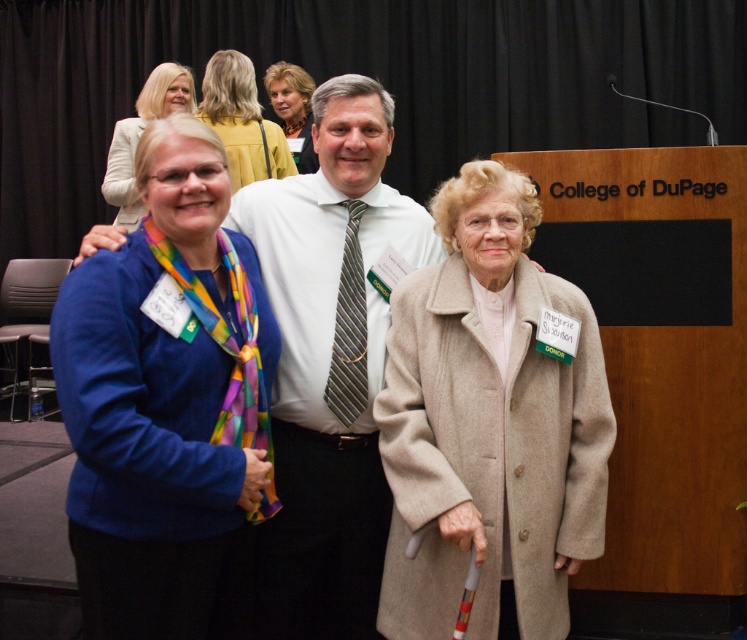
You are a photographer at the College of DuPage event. You need to ensure that the white shirt at center and the striped fabric tie at center are both visible in the photo. Given that your camera has a minimum focus distance of 15 centimeters, will both items be in focus?

The distance between the white shirt at center and the striped fabric tie at center is 16.55 centimeters. Since the minimum focus distance of the camera is 15 centimeters, both items will be within the focus range and thus visible clearly in the photo.

You are a photographer at the College of DuPage event and need to adjust the lighting to ensure both the blue soft scarf at left and the matte blue sweater at upper left are well lit. Since the scarf is on the right side of the sweater, where should you position the light source to avoid shadows on both items?

To avoid shadows on both the blue soft scarf at left and the matte blue sweater at upper left, position the light source to the right side of the setup, as the scarf is on the right side of the sweater. This way, the light will evenly illuminate both items without casting shadows between them.

You are a photographer at the College of DuPage event. You need to ensure that both the blue soft scarf at left and the matte blue sweater at upper left are clearly visible in the photo. Given their sizes, which one might require you to adjust your camera angle to capture more detail?

The blue soft scarf at left is larger in size than the matte blue sweater at upper left, so you might need to adjust the camera angle to ensure the larger blue soft scarf at left is captured in full detail without cropping.